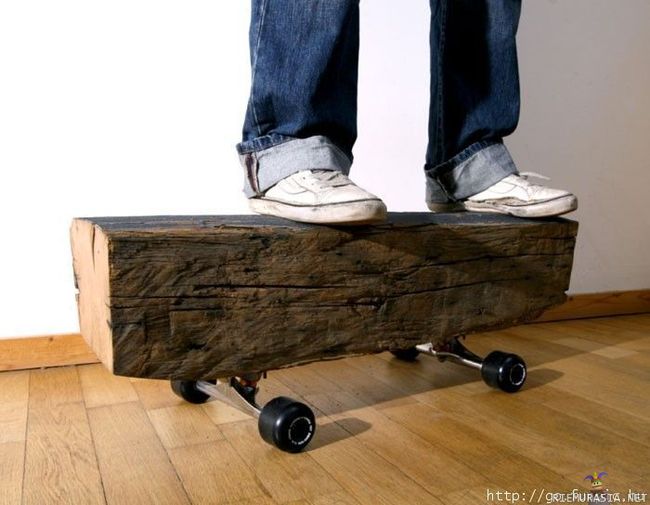
Where is `wall`? wall is located at coordinates click(157, 157).